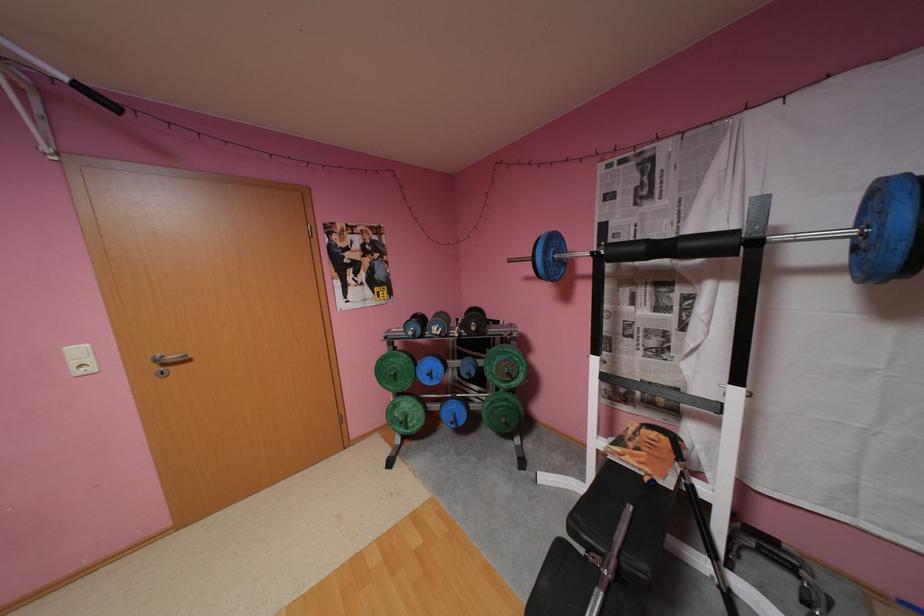
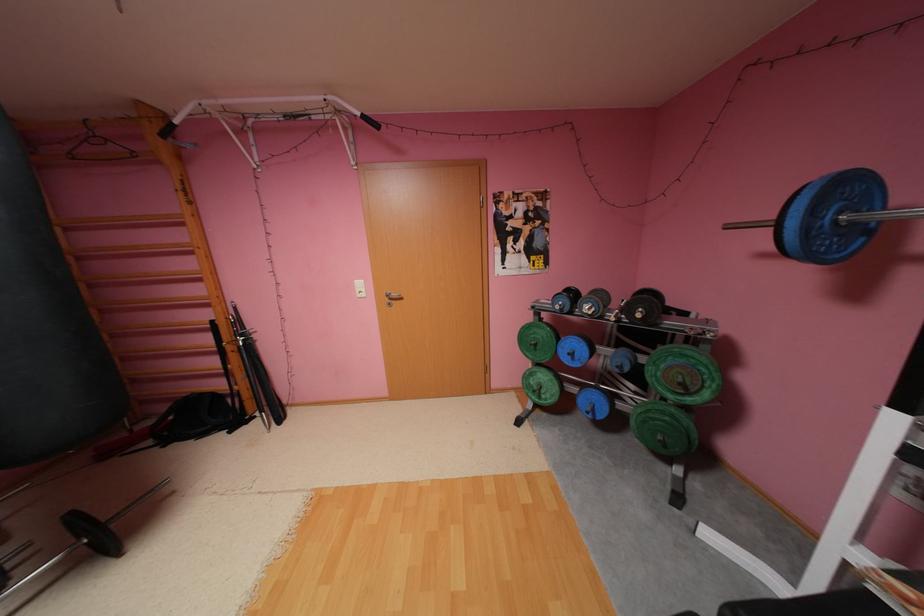
Locate, in the second image, the point that corresponds to (x=517, y=374) in the first image.

(690, 384)